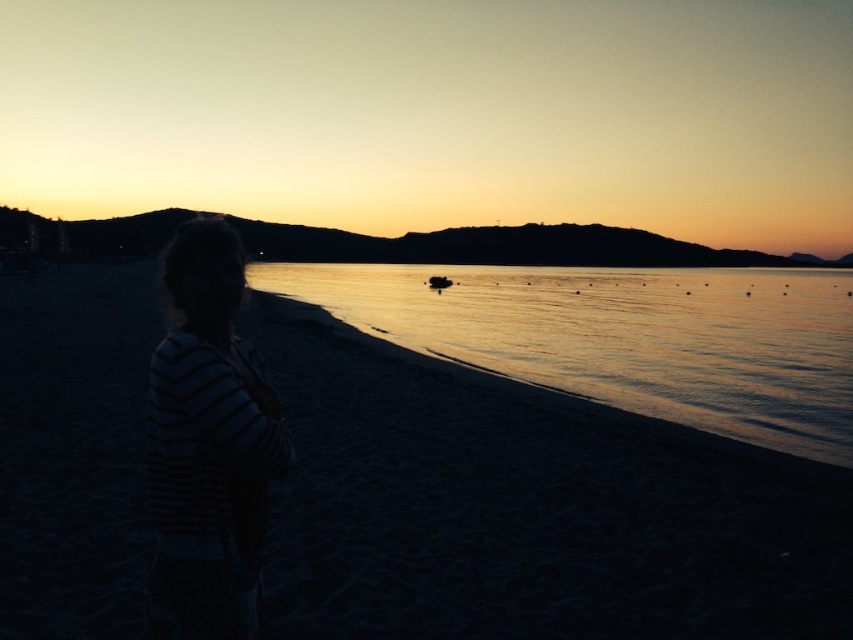
You are standing on the beach and want to walk from the dark sand at lower left to the glistening water at center. Which direction should you move towards?

You should move towards the right side because the dark sand at lower left is positioned on the left side of the glistening water at center.

You are standing at the point marked as point (x=566, y=502) on the beach. If you want to take a photo of the sunset with the camera, which is 6.30 meters away from you, in which direction should you move to get closer to the camera?

To get closer to the camera, you should move towards the camera, which is 6.30 meters away from point (x=566, y=502).